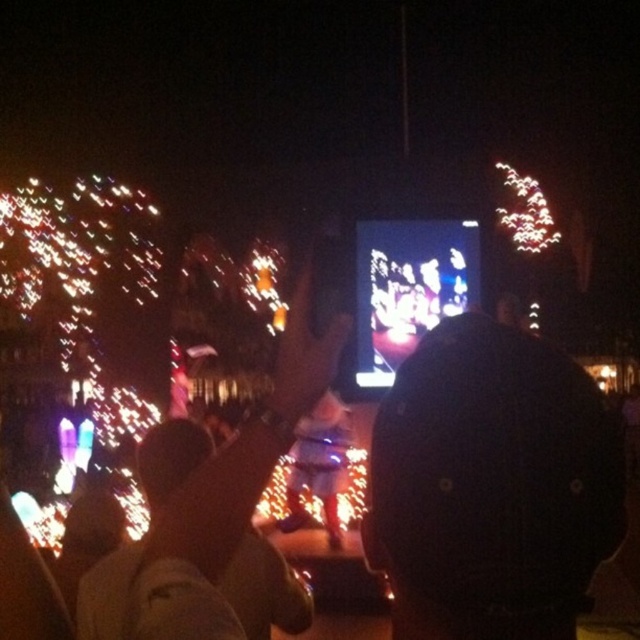
You are a photographer at the concert trying to capture the stage lights. You notice the black matte jacket at center and the shiny plastic phone at center. Which object is closer to the left side of the frame?

The black matte jacket at center is positioned on the left side of the shiny plastic phone at center, so it is closer to the left side of the frame.

Based on the photo, you are at the concert and want to take a photo of the shiny gold jacket at center. Where should you aim your camera to capture it?

You should aim your camera at point 0.773 on the x axis and 0.334 on the y axis to capture the shiny gold jacket at center.